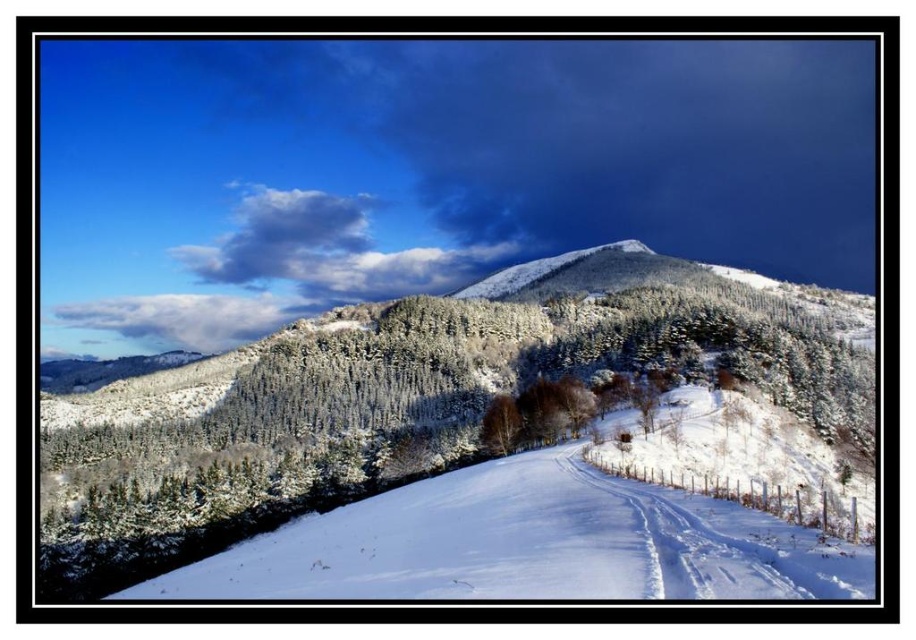
You are planning a winter hike and see the white snow ski slope at center and the brown wood tree at center in the image. Which object is positioned to the east if the sun is setting in the west?

The white snow ski slope at center is to the right of the brown wood tree at center. Since the sun is setting in the west, the tree would cast a shadow towards the east. Therefore, the white snow ski slope at center, being to the right of the tree, would be positioned to the east.

You are planning a ski trip and need to know the elevation difference between the white snow ski slope at center and the brown wood tree at center. Can you determine which one is higher based on the scene?

The white snow ski slope at center is above the brown wood tree at center, so the ski slope is higher in elevation than the tree.

You are planning to take a photo of the white snow ski slope at center and the brown wood tree at center from the middle of the snow road. Which object will appear wider in the photo?

The white snow ski slope at center will appear wider in the photo because its width is larger than that of the brown wood tree at center.